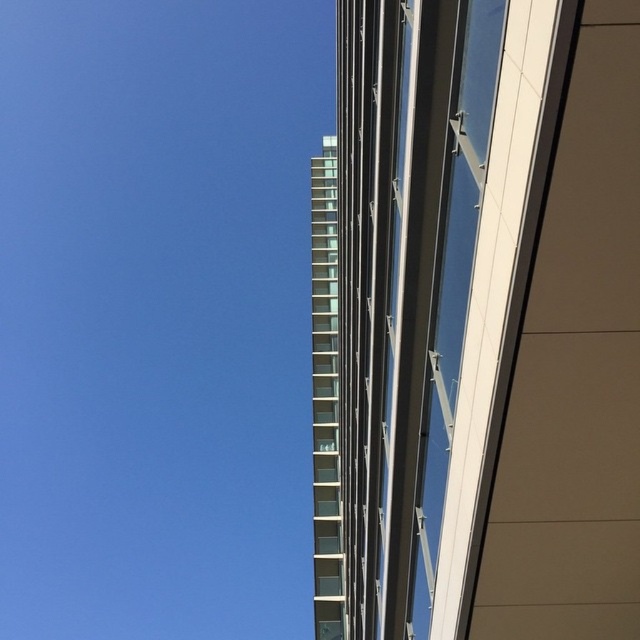
You are an architect evaluating the building facade. You notice the transparent glass tower at upper center and the clear glass windows at center. Which of these two elements has a greater width in the image?

The transparent glass tower at upper center has a greater width than the clear glass windows at center according to the description.

You are standing in front of the building and want to determine which of the two points, point [435,212] or point [323,385], is nearer to you. Based on the scene, which point is closer?

Point [435,212] is closer to the viewer than point [323,385].